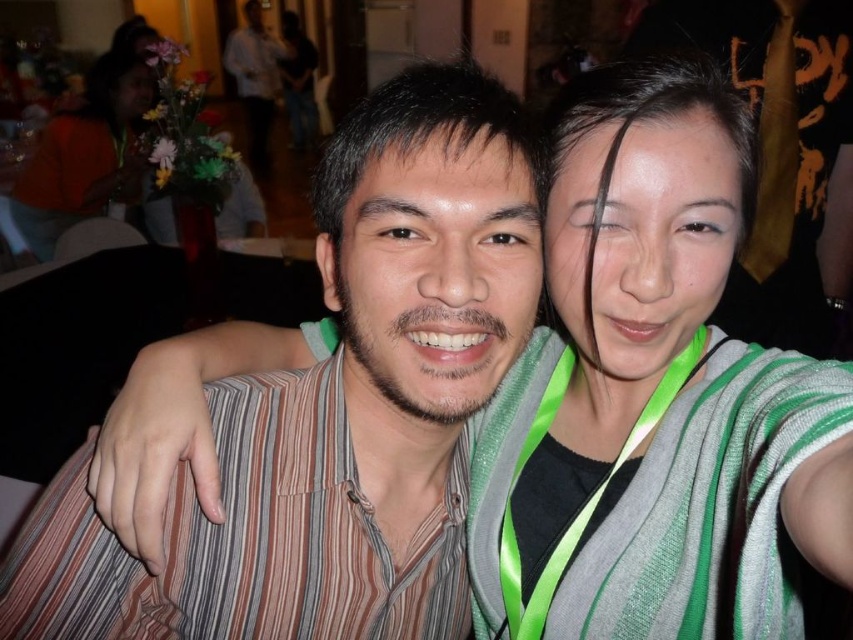
You are at a social event and want to take a photo with the striped shirt at center and the orange fabric at upper left. Which object should you focus on first if you want to capture both in one shot without moving the camera?

You should focus on the striped shirt at center first because it is positioned under the orange fabric at upper left, meaning it is closer to the camera. This will ensure both are in focus as the depth of field may capture the background object as well.